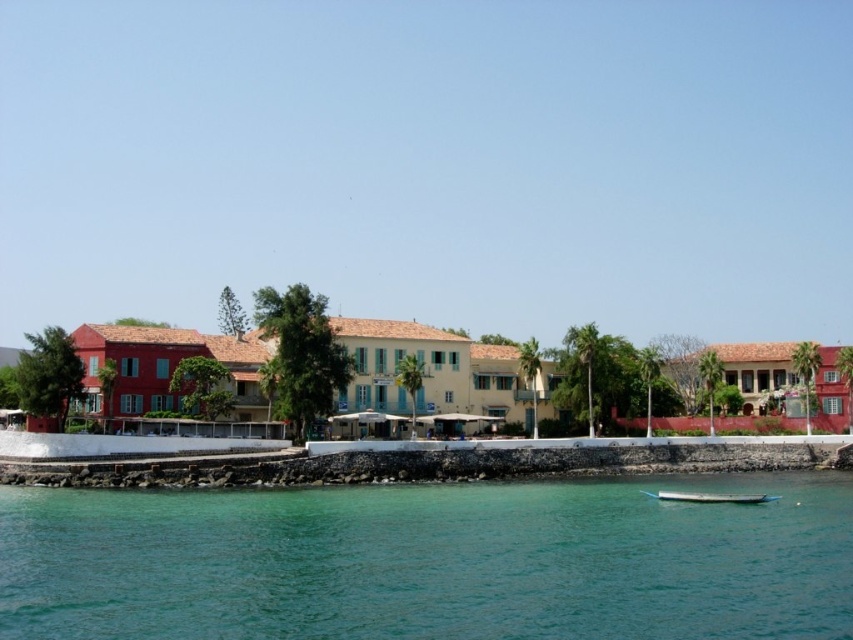
Question: Is clear water at lower center smaller than wooden boat at lower center?

Choices:
 (A) yes
 (B) no

Answer: (B)

Question: Which object appears closest to the camera in this image?

Choices:
 (A) wooden boat at lower center
 (B) clear water at lower center

Answer: (B)

Question: Which of the following is the farthest from the observer?

Choices:
 (A) clear water at lower center
 (B) wooden boat at lower center

Answer: (B)

Question: Considering the relative positions of clear water at lower center and wooden boat at lower center in the image provided, where is clear water at lower center located with respect to wooden boat at lower center?

Choices:
 (A) left
 (B) right

Answer: (A)

Question: Which point is farther to the camera?

Choices:
 (A) (734, 500)
 (B) (320, 493)

Answer: (B)

Question: Where is clear water at lower center located in relation to wooden boat at lower center in the image?

Choices:
 (A) above
 (B) below

Answer: (A)